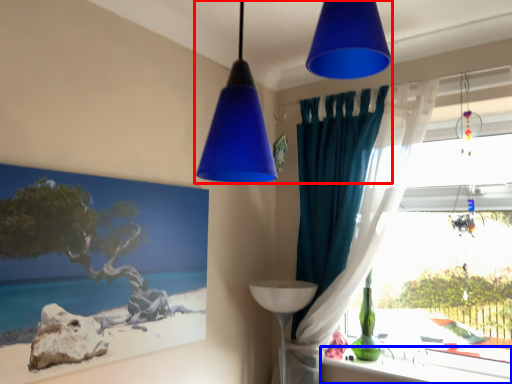
Question: Which object is closer to the camera taking this photo, lamp (highlighted by a red box) or window sill (highlighted by a blue box)?

Choices:
 (A) lamp
 (B) window sill

Answer: (A)